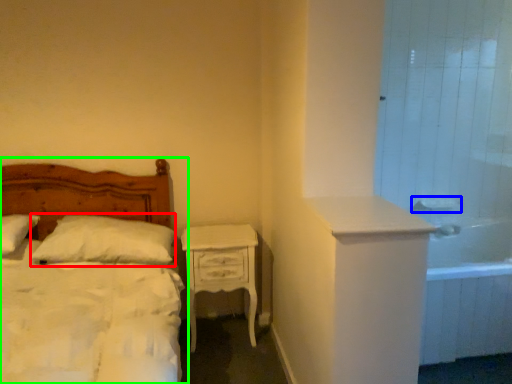
Question: Which object is positioned farthest from pillow (highlighted by a red box)? Select from sink (highlighted by a blue box) and bed (highlighted by a green box).

Choices:
 (A) sink
 (B) bed

Answer: (A)